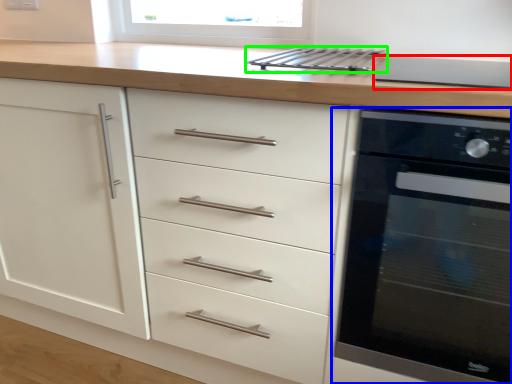
Question: Which is nearer to the appliance (highlighted by a red box)? home appliance (highlighted by a blue box) or kitchen appliance (highlighted by a green box).

Choices:
 (A) home appliance
 (B) kitchen appliance

Answer: (B)